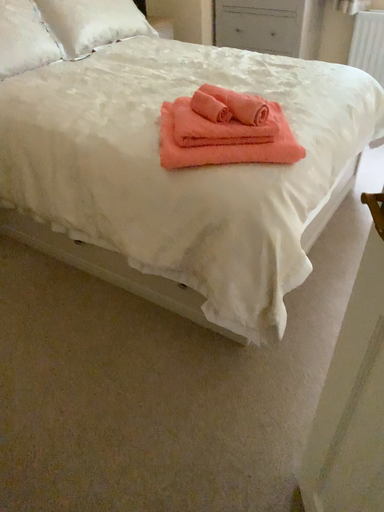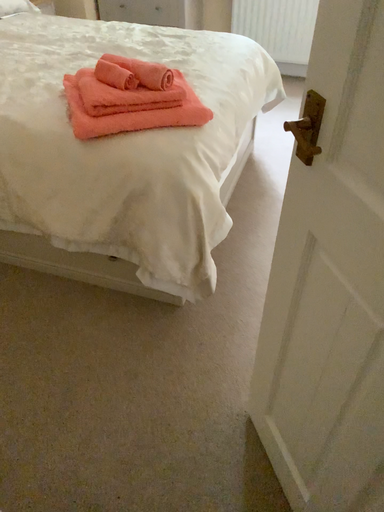
Question: How did the camera likely rotate when shooting the video?

Choices:
 (A) rotated left
 (B) rotated right

Answer: (B)